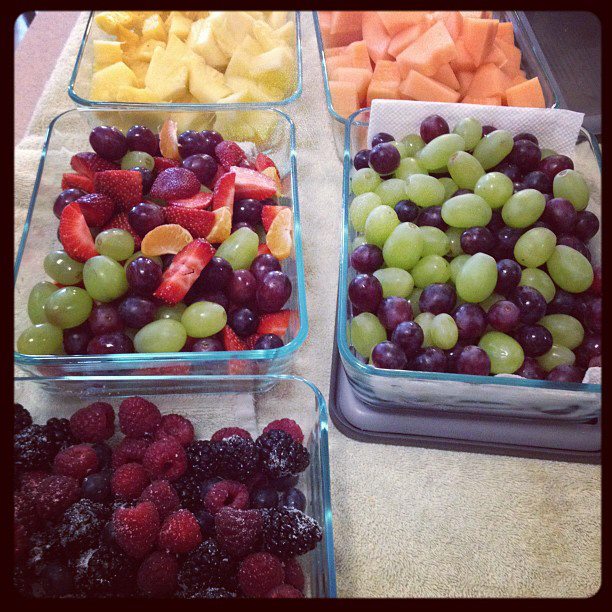
At what (x,y) coordinates should I click in order to perform the action: click on floor. Please return your answer as a coordinate pair (x, y). Looking at the image, I should click on (501, 490).